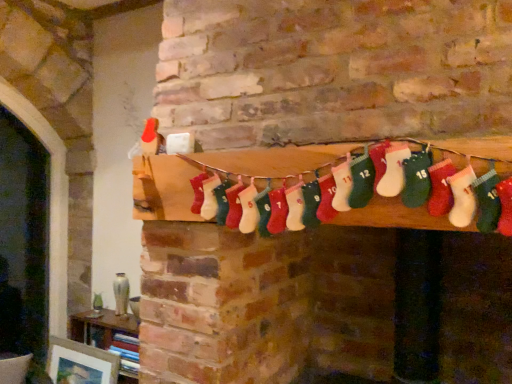
Question: Is matte white picture frame at lower left far from red knitted stocking at center?

Choices:
 (A) yes
 (B) no

Answer: (A)

Question: From a real-world perspective, is matte white picture frame at lower left physically below red knitted stocking at center?

Choices:
 (A) no
 (B) yes

Answer: (B)

Question: Is the surface of matte white picture frame at lower left in direct contact with red knitted stocking at center?

Choices:
 (A) yes
 (B) no

Answer: (B)

Question: Can you confirm if matte white picture frame at lower left is shorter than red knitted stocking at center?

Choices:
 (A) yes
 (B) no

Answer: (B)

Question: Does matte white picture frame at lower left have a smaller size compared to red knitted stocking at center?

Choices:
 (A) yes
 (B) no

Answer: (A)

Question: Considering the positions of matte white picture frame at lower left and wooden bookshelf at lower left in the image, is matte white picture frame at lower left wider or thinner than wooden bookshelf at lower left?

Choices:
 (A) wide
 (B) thin

Answer: (B)

Question: From a real-world perspective, is matte white picture frame at lower left above or below wooden bookshelf at lower left?

Choices:
 (A) above
 (B) below

Answer: (B)

Question: From the image's perspective, is matte white picture frame at lower left positioned above or below wooden bookshelf at lower left?

Choices:
 (A) below
 (B) above

Answer: (A)

Question: Considering the positions of matte white picture frame at lower left and wooden bookshelf at lower left in the image, is matte white picture frame at lower left bigger or smaller than wooden bookshelf at lower left?

Choices:
 (A) small
 (B) big

Answer: (A)

Question: From the image's perspective, is wooden bookshelf at lower left located above or below matte white picture frame at lower left?

Choices:
 (A) above
 (B) below

Answer: (A)

Question: Considering the positions of wooden bookshelf at lower left and matte white picture frame at lower left in the image, is wooden bookshelf at lower left wider or thinner than matte white picture frame at lower left?

Choices:
 (A) wide
 (B) thin

Answer: (A)

Question: Is wooden bookshelf at lower left spatially inside matte white picture frame at lower left, or outside of it?

Choices:
 (A) outside
 (B) inside

Answer: (A)

Question: Is point [x=128, y=326] closer or farther from the camera than point [x=56, y=359]?

Choices:
 (A) farther
 (B) closer

Answer: (B)

Question: Considering the positions of red knitted stocking at center and matte white picture frame at lower left in the image, is red knitted stocking at center wider or thinner than matte white picture frame at lower left?

Choices:
 (A) thin
 (B) wide

Answer: (B)

Question: Does point (208, 162) appear closer or farther from the camera than point (113, 365)?

Choices:
 (A) farther
 (B) closer

Answer: (B)